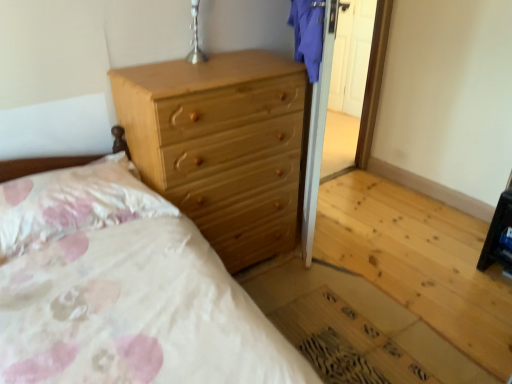
Where is `natural wood chest of drawers at upper center`? Image resolution: width=512 pixels, height=384 pixels. natural wood chest of drawers at upper center is located at coordinates (220, 145).

What do you see at coordinates (195, 37) in the screenshot? I see `silver metallic table lamp at upper center` at bounding box center [195, 37].

This screenshot has height=384, width=512. In order to click on silver metallic table lamp at upper center in this screenshot , I will do `click(195, 37)`.

This screenshot has height=384, width=512. Find the location of `fluffy white pillow at upper left`. fluffy white pillow at upper left is located at coordinates (74, 203).

At what (x,y) coordinates should I click in order to perform the action: click on natural wood chest of drawers at upper center. Please return your answer as a coordinate pair (x, y). The image size is (512, 384). Looking at the image, I should click on (220, 145).

Is fluffy white pillow at upper left not close to silver metallic table lamp at upper center?

fluffy white pillow at upper left is actually quite close to silver metallic table lamp at upper center.

Considering the positions of objects fluffy white pillow at upper left and silver metallic table lamp at upper center in the image provided, who is more to the right, fluffy white pillow at upper left or silver metallic table lamp at upper center?

Positioned to the right is silver metallic table lamp at upper center.

From the image's perspective, is fluffy white pillow at upper left located above silver metallic table lamp at upper center?

No, from the image's perspective, fluffy white pillow at upper left is not above silver metallic table lamp at upper center.

Considering the positions of objects natural wood chest of drawers at upper center and silver metallic table lamp at upper center in the image provided, who is behind, natural wood chest of drawers at upper center or silver metallic table lamp at upper center?

silver metallic table lamp at upper center is more distant.

From the image's perspective, relative to silver metallic table lamp at upper center, is natural wood chest of drawers at upper center above or below?

natural wood chest of drawers at upper center is situated lower than silver metallic table lamp at upper center in the image.

From the picture: Is natural wood chest of drawers at upper center not inside silver metallic table lamp at upper center?

Absolutely, natural wood chest of drawers at upper center is external to silver metallic table lamp at upper center.

Is natural wood chest of drawers at upper center in contact with silver metallic table lamp at upper center?

They are not placed beside each other.

Who is bigger, fluffy white pillow at upper left or natural wood chest of drawers at upper center?

natural wood chest of drawers at upper center is bigger.

Measure the distance between fluffy white pillow at upper left and natural wood chest of drawers at upper center.

The distance of fluffy white pillow at upper left from natural wood chest of drawers at upper center is 42.26 centimeters.

Is fluffy white pillow at upper left positioned far away from natural wood chest of drawers at upper center?

No, there isn't a large distance between fluffy white pillow at upper left and natural wood chest of drawers at upper center.

Which object is further away from the camera taking this photo, fluffy white pillow at upper left or natural wood chest of drawers at upper center?

Positioned behind is natural wood chest of drawers at upper center.

Can you tell me how much natural wood chest of drawers at upper center and fluffy white pillow at upper left differ in facing direction?

There is a 1.76-degree angle between the facing directions of natural wood chest of drawers at upper center and fluffy white pillow at upper left.

Could you tell me if natural wood chest of drawers at upper center is turned towards fluffy white pillow at upper left?

No, natural wood chest of drawers at upper center is not turned towards fluffy white pillow at upper left.

Based on the photo, which object is wider, natural wood chest of drawers at upper center or fluffy white pillow at upper left?

natural wood chest of drawers at upper center is wider.

Is natural wood chest of drawers at upper center shorter than fluffy white pillow at upper left?

In fact, natural wood chest of drawers at upper center may be taller than fluffy white pillow at upper left.

Between silver metallic table lamp at upper center and natural wood chest of drawers at upper center, which one has smaller width?

Thinner between the two is silver metallic table lamp at upper center.

Locate an element on the screen. chest of drawers to the right of silver metallic table lamp at upper center is located at coordinates (220, 145).

Which point is more forward, [186,60] or [124,79]?

The point [124,79] is more forward.

From a real-world perspective, does silver metallic table lamp at upper center sit lower than natural wood chest of drawers at upper center?

Actually, silver metallic table lamp at upper center is physically above natural wood chest of drawers at upper center in the real world.

Would you consider silver metallic table lamp at upper center to be distant from fluffy white pillow at upper left?

No, there isn't a large distance between silver metallic table lamp at upper center and fluffy white pillow at upper left.

Between silver metallic table lamp at upper center and fluffy white pillow at upper left, which one is positioned behind?

silver metallic table lamp at upper center.

Would you say silver metallic table lamp at upper center is outside fluffy white pillow at upper left?

silver metallic table lamp at upper center lies outside fluffy white pillow at upper left's area.

From the picture: Is silver metallic table lamp at upper center oriented towards fluffy white pillow at upper left?

No, silver metallic table lamp at upper center is not turned towards fluffy white pillow at upper left.

Where is `table lamp that appears above the fluffy white pillow at upper left (from a real-world perspective)`? This screenshot has height=384, width=512. table lamp that appears above the fluffy white pillow at upper left (from a real-world perspective) is located at coordinates (195, 37).

In order to click on table lamp located behind the natural wood chest of drawers at upper center in this screenshot , I will do `click(195, 37)`.

From the image, which object appears to be farther from natural wood chest of drawers at upper center, fluffy white pillow at upper left or silver metallic table lamp at upper center?

Based on the image, silver metallic table lamp at upper center appears to be further to natural wood chest of drawers at upper center.

When comparing their distances from fluffy white pillow at upper left, does silver metallic table lamp at upper center or natural wood chest of drawers at upper center seem closer?

The object closer to fluffy white pillow at upper left is natural wood chest of drawers at upper center.

Estimate the real-world distances between objects in this image. Which object is closer to fluffy white pillow at upper left, natural wood chest of drawers at upper center or silver metallic table lamp at upper center?

natural wood chest of drawers at upper center lies closer to fluffy white pillow at upper left than the other object.

Looking at this image, based on their spatial positions, is silver metallic table lamp at upper center or fluffy white pillow at upper left closer to natural wood chest of drawers at upper center?

fluffy white pillow at upper left is positioned closer to the anchor natural wood chest of drawers at upper center.

Looking at the image, which one is located further to silver metallic table lamp at upper center, fluffy white pillow at upper left or natural wood chest of drawers at upper center?

Based on the image, fluffy white pillow at upper left appears to be further to silver metallic table lamp at upper center.

Estimate the real-world distances between objects in this image. Which object is further from silver metallic table lamp at upper center, natural wood chest of drawers at upper center or fluffy white pillow at upper left?

fluffy white pillow at upper left lies further to silver metallic table lamp at upper center than the other object.

In order to click on chest of drawers between silver metallic table lamp at upper center and fluffy white pillow at upper left in the up-down direction in this screenshot , I will do `click(220, 145)`.